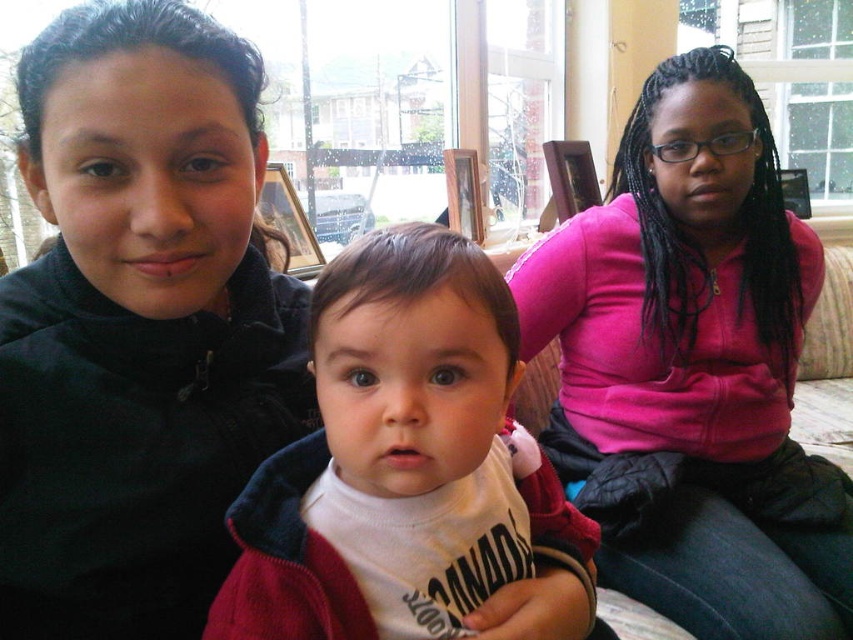
Who is more distant from viewer, [775,204] or [334,429]?

The point [775,204] is more distant.

Can you confirm if pink fleece at center is taller than white soft fabric at center?

Indeed, pink fleece at center has a greater height compared to white soft fabric at center.

At what (x,y) coordinates should I click in order to perform the action: click on pink fleece at center. Please return your answer as a coordinate pair (x, y). This screenshot has width=853, height=640. Looking at the image, I should click on (693, 369).